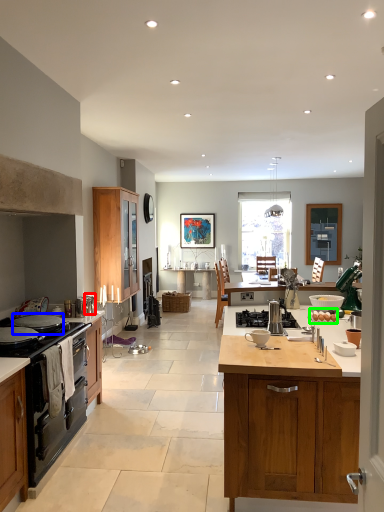
Question: Estimate the real-world distances between objects in this image. Which object is closer to appliance (highlighted by a red box), appliance (highlighted by a blue box) or food (highlighted by a green box)?

Choices:
 (A) appliance
 (B) food

Answer: (A)